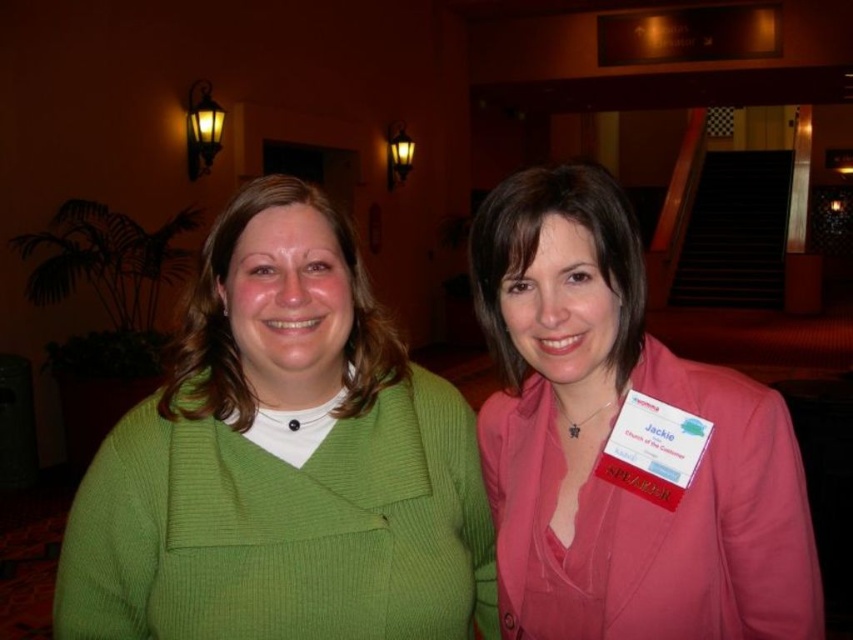
Question: Which point is farther from the camera taking this photo?

Choices:
 (A) (495, 289)
 (B) (355, 384)

Answer: (B)

Question: Which point is farther to the camera?

Choices:
 (A) (621, 326)
 (B) (299, 289)

Answer: (A)

Question: Which object appears closest to the camera in this image?

Choices:
 (A) pink satin blazer at center
 (B) green ribbed sweater at center

Answer: (A)

Question: Can you confirm if green ribbed sweater at center is positioned above pink satin blazer at center?

Choices:
 (A) no
 (B) yes

Answer: (A)

Question: Observing the image, what is the correct spatial positioning of green ribbed sweater at center in reference to pink satin blazer at center?

Choices:
 (A) above
 (B) below

Answer: (B)

Question: Can you confirm if green ribbed sweater at center is positioned above pink satin blazer at center?

Choices:
 (A) yes
 (B) no

Answer: (B)